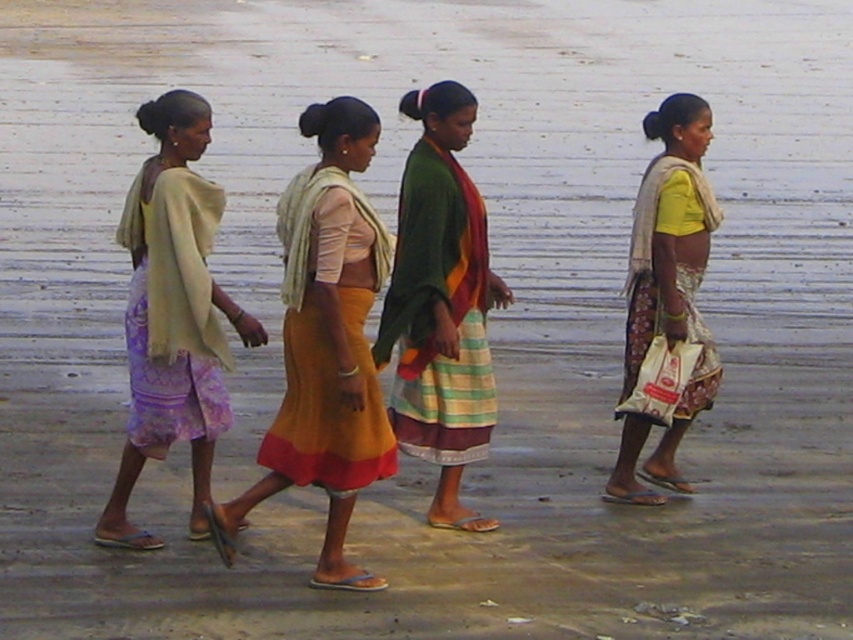
Does yellow cotton shirt at center have a larger size compared to lavender printed fabric dress at left?

Correct, yellow cotton shirt at center is larger in size than lavender printed fabric dress at left.

Does point (619, 484) lie behind point (190, 424)?

Yes, point (619, 484) is behind point (190, 424).

Does point (648, 129) lie in front of point (200, 349)?

No, (648, 129) is further to viewer.

The height and width of the screenshot is (640, 853). Find the location of `yellow cotton shirt at center`. yellow cotton shirt at center is located at coordinates (672, 268).

Between matte yellow skirt at center and orange cotton dress at center, which one appears on the left side from the viewer's perspective?

From the viewer's perspective, matte yellow skirt at center appears more on the left side.

Consider the image. Can you confirm if matte yellow skirt at center is bigger than orange cotton dress at center?

Indeed, matte yellow skirt at center has a larger size compared to orange cotton dress at center.

Does point (347, 588) lie in front of point (339, 456)?

Yes, point (347, 588) is in front of point (339, 456).

What are the coordinates of `matte yellow skirt at center` in the screenshot? It's located at (328, 339).

Between point (309, 248) and point (173, 225), which one is positioned behind?

The point (173, 225) is behind.

Consider the image. Which of these two, orange cotton dress at center or lavender printed fabric dress at left, stands shorter?

With less height is lavender printed fabric dress at left.

Who is more forward, [297,403] or [166,349]?

Point [297,403] is in front.

Locate an element on the screen. This screenshot has width=853, height=640. orange cotton dress at center is located at coordinates (326, 346).